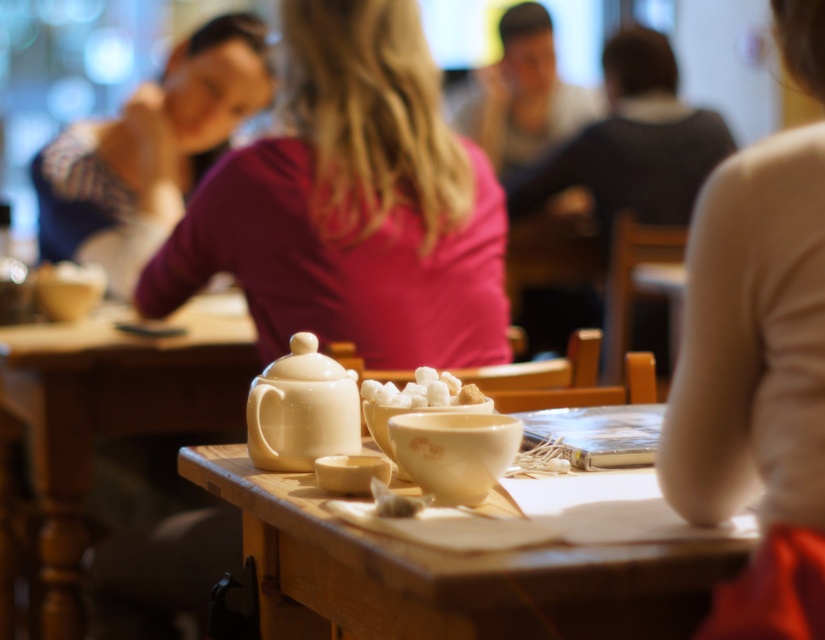
Question: Can you confirm if matte ceramic table at center is bigger than matte ceramic cup at center?

Choices:
 (A) no
 (B) yes

Answer: (B)

Question: Which point is closer to the camera taking this photo?

Choices:
 (A) (705, 595)
 (B) (205, 326)

Answer: (A)

Question: Which point is closer to the camera?

Choices:
 (A) matte ceramic cup at center
 (B) white ceramic cup at center

Answer: (B)

Question: Which point is farther from the camera taking this photo?

Choices:
 (A) click(474, 392)
 (B) click(257, 428)
 (C) click(453, 433)
 (D) click(530, 552)

Answer: (A)

Question: Is white glossy teapot at center smaller than white ceramic cup at center?

Choices:
 (A) yes
 (B) no

Answer: (B)

Question: Can you confirm if matte pink shirt at center is positioned to the left of matte white teapot at lower left?

Choices:
 (A) no
 (B) yes

Answer: (A)